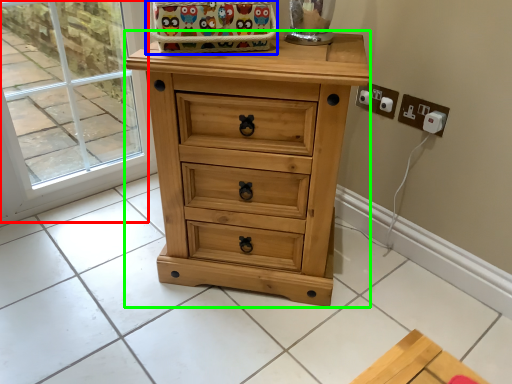
Question: Estimate the real-world distances between objects in this image. Which object is farther from glass door (highlighted by a red box), basket (highlighted by a blue box) or chest of drawers (highlighted by a green box)?

Choices:
 (A) basket
 (B) chest of drawers

Answer: (B)